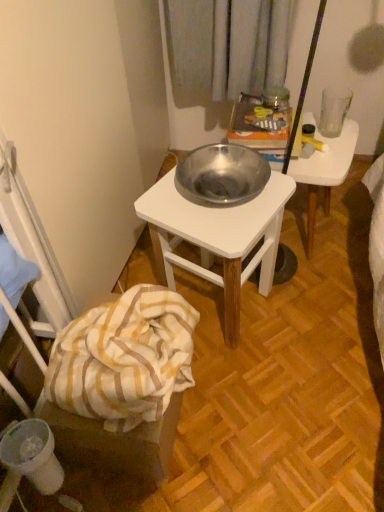
At what (x,y) coordinates should I click in order to perform the action: click on free space to the right of yellow striped fabric at lower left. Please return your answer as a coordinate pair (x, y). Image resolution: width=384 pixels, height=512 pixels. Looking at the image, I should click on (248, 410).